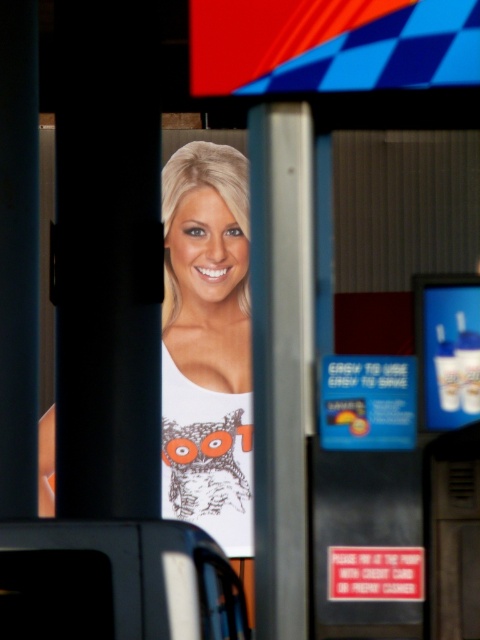
Based on the scene description, where is the metallic silver pillar at center located in the image?

The metallic silver pillar at center is located at point (280, 358).

You are a delivery driver who needs to place a small package between the blue plastic credit card at center and the white glossy cup at right. Can the package fit in the space between them?

The distance between the blue plastic credit card at center and the white glossy cup at right is 5.71 inches, so the package can fit if it is smaller than 5.71 inches in width.

Based on the photo, you are a driver who just entered the gas station. You need to pay using the blue plastic credit card at center. Where should you look to find it?

The blue plastic credit card at center is located at point (368, 403), which is near the center of the image.